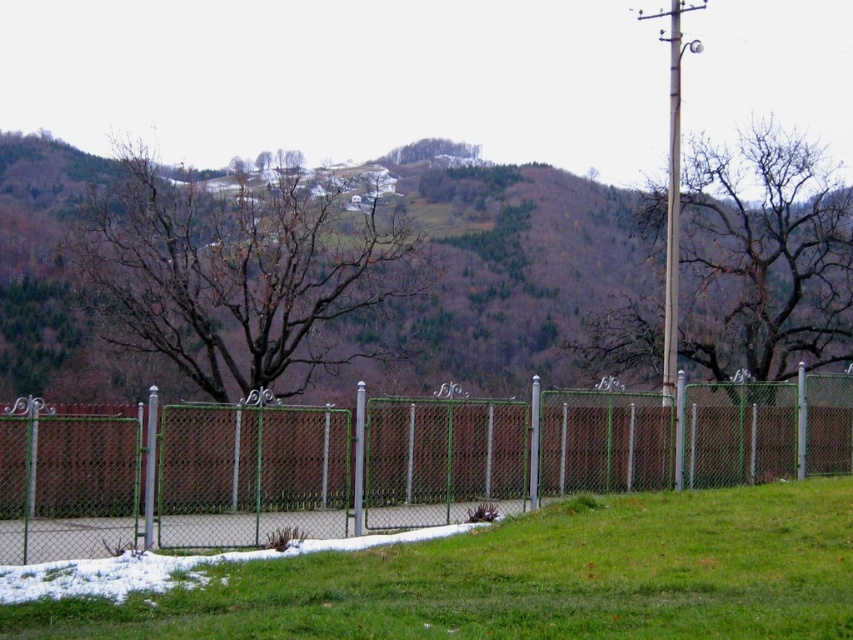
Between green chain-link fence at center and bare wood tree at center, which one is positioned lower?

Positioned lower is green chain-link fence at center.

Between point (828, 470) and point (695, 250), which one is positioned behind?

The point (695, 250) is behind.

Who is more distant from viewer, (271, 417) or (810, 148)?

Point (810, 148)

Image resolution: width=853 pixels, height=640 pixels. In order to click on green chain-link fence at center in this screenshot , I will do `click(694, 436)`.

Does bare wood tree at center have a smaller size compared to metallic pole at center?

No.

Does bare wood tree at center have a lesser width compared to metallic pole at center?

Incorrect, bare wood tree at center's width is not less than metallic pole at center's.

The image size is (853, 640). What do you see at coordinates (763, 257) in the screenshot? I see `bare wood tree at center` at bounding box center [763, 257].

Where is `bare wood tree at center`? This screenshot has width=853, height=640. bare wood tree at center is located at coordinates (763, 257).

Does green grass at lower center have a larger size compared to bare wood tree at center?

Actually, green grass at lower center might be smaller than bare wood tree at center.

Which is behind, point (583, 564) or point (824, 262)?

The point (824, 262) is more distant.

Locate an element on the screen. The height and width of the screenshot is (640, 853). green grass at lower center is located at coordinates (531, 579).